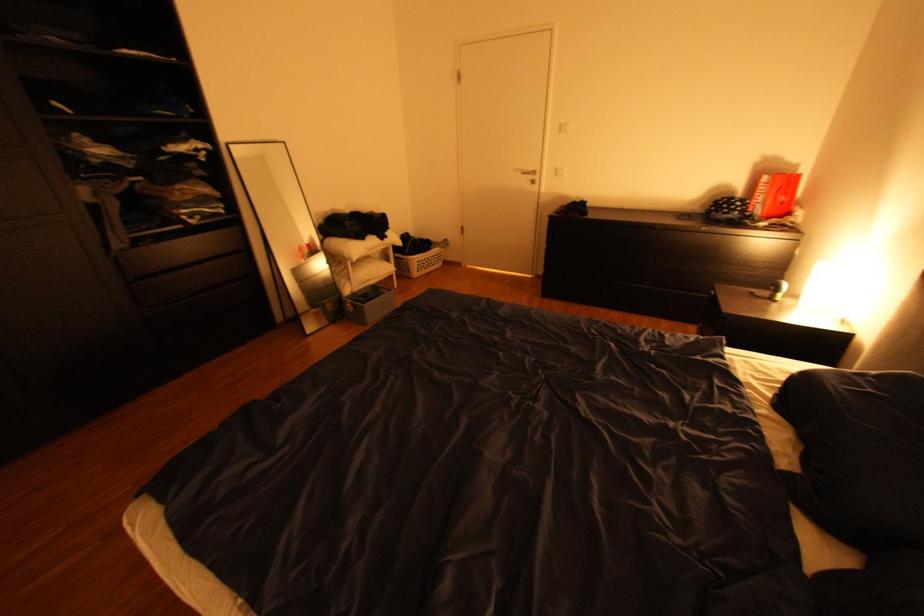
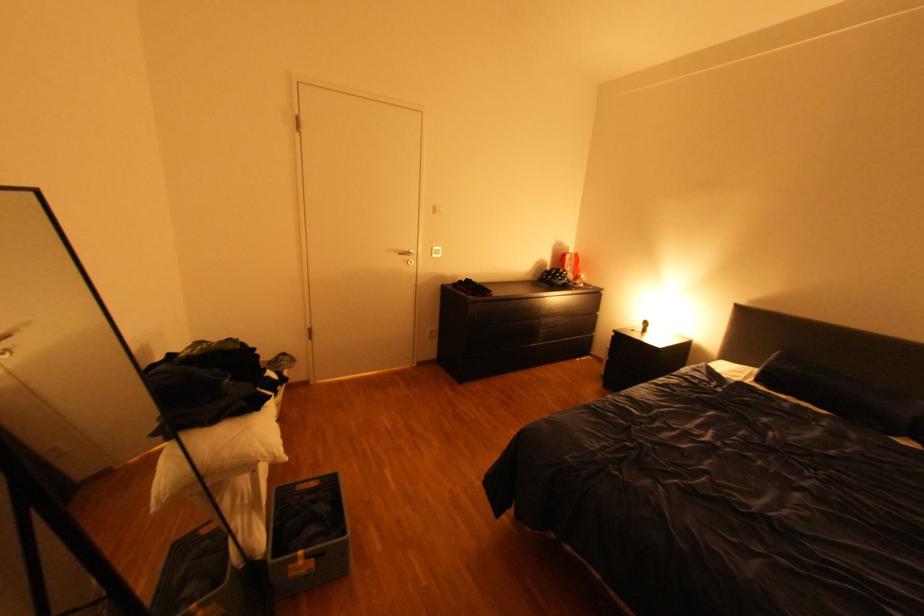
Find the pixel in the second image that matches point (779, 395) in the first image.

(771, 387)